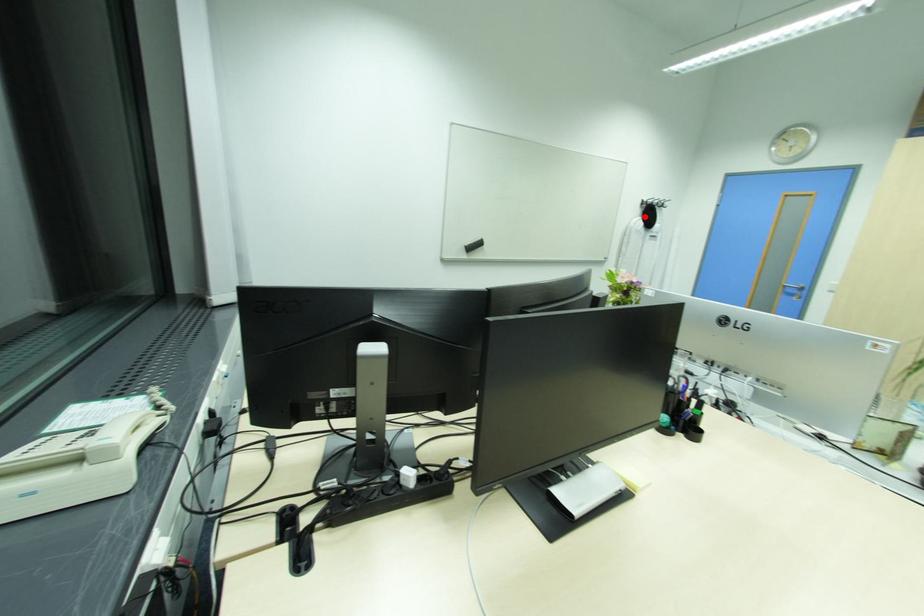
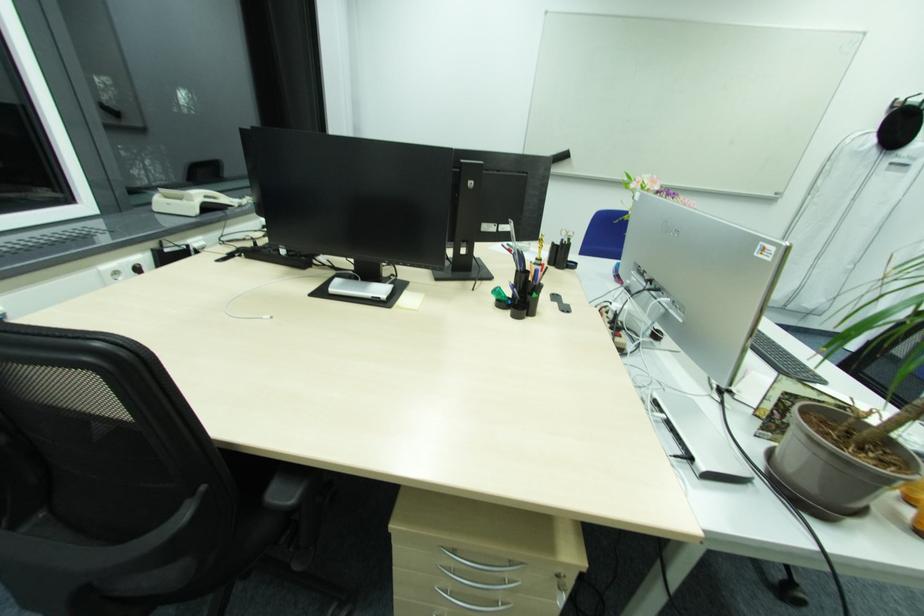
The point at the highlighted location is marked in the first image. Where is the corresponding point in the second image?

(881, 130)